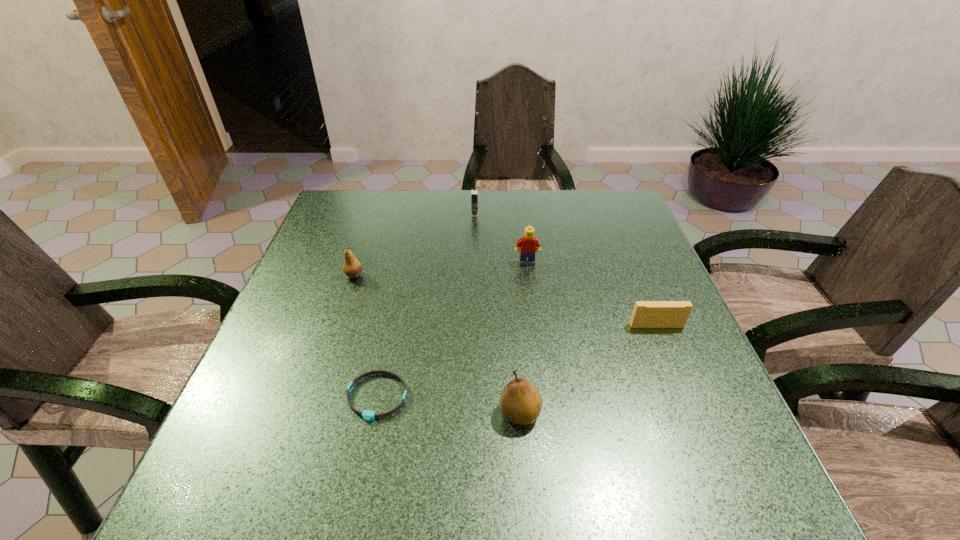
At what (x,y) coordinates should I click in order to perform the action: click on vacant region that satisfies the following two spatial constraints: 1. on the buckle of the right pear; 2. on the left side of the shortest object. Please return your answer as a coordinate pair (x, y). Looking at the image, I should click on (373, 413).

The width and height of the screenshot is (960, 540). I want to click on free spot that satisfies the following two spatial constraints: 1. on the front side of the farther pear; 2. on the right side of the right pear, so click(309, 413).